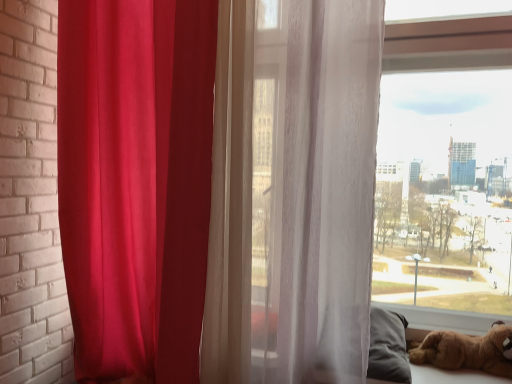
Question: Can you confirm if matte red curtain at left, which is the second curtain from right to left, is bigger than translucent white curtain at center, the 1th curtain from the right?

Choices:
 (A) yes
 (B) no

Answer: (A)

Question: Does matte red curtain at left, the first curtain viewed from the left, turn towards translucent white curtain at center, which is counted as the second curtain, starting from the left?

Choices:
 (A) no
 (B) yes

Answer: (A)

Question: Is matte red curtain at left, the first curtain viewed from the left, located outside translucent white curtain at center, the 1th curtain from the right?

Choices:
 (A) no
 (B) yes

Answer: (B)

Question: Does matte red curtain at left, the first curtain viewed from the left, have a lesser height compared to translucent white curtain at center, the 1th curtain from the right?

Choices:
 (A) yes
 (B) no

Answer: (B)

Question: Are matte red curtain at left, the first curtain viewed from the left, and translucent white curtain at center, which is counted as the second curtain, starting from the left, making contact?

Choices:
 (A) no
 (B) yes

Answer: (A)

Question: Is the depth of matte red curtain at left, the first curtain viewed from the left, less than that of translucent white curtain at center, the 1th curtain from the right?

Choices:
 (A) yes
 (B) no

Answer: (B)

Question: From a real-world perspective, is translucent white curtain at center, the 1th curtain from the right, over brown plush toy at lower right?

Choices:
 (A) no
 (B) yes

Answer: (B)

Question: Can you confirm if translucent white curtain at center, which is counted as the second curtain, starting from the left, is thinner than brown plush toy at lower right?

Choices:
 (A) no
 (B) yes

Answer: (A)

Question: Considering the relative positions of translucent white curtain at center, the 1th curtain from the right, and brown plush toy at lower right in the image provided, is translucent white curtain at center, the 1th curtain from the right, in front of brown plush toy at lower right?

Choices:
 (A) yes
 (B) no

Answer: (A)

Question: Is translucent white curtain at center, which is counted as the second curtain, starting from the left, next to brown plush toy at lower right?

Choices:
 (A) yes
 (B) no

Answer: (B)

Question: Is translucent white curtain at center, the 1th curtain from the right, oriented away from brown plush toy at lower right?

Choices:
 (A) no
 (B) yes

Answer: (A)

Question: Does translucent white curtain at center, the 1th curtain from the right, have a larger size compared to brown plush toy at lower right?

Choices:
 (A) no
 (B) yes

Answer: (B)

Question: From the image's perspective, would you say brown plush toy at lower right is shown under matte red curtain at left, which is the second curtain from right to left?

Choices:
 (A) yes
 (B) no

Answer: (A)